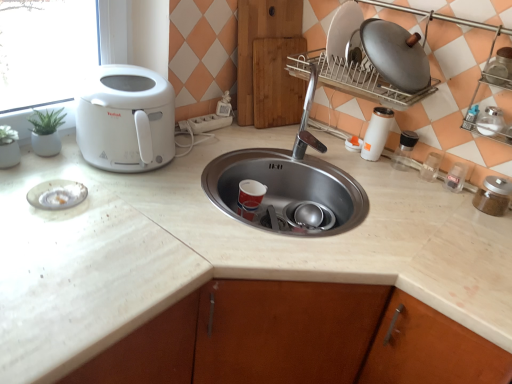
Question: Should I look upward or downward to see metallic silver pot at upper right, which is counted as the sixth appliance, starting from the left?

Choices:
 (A) down
 (B) up

Answer: (B)

Question: From a real-world perspective, is transparent plastic container at right, the fourth appliance in the left-to-right sequence, located beneath metallic silver pot at upper right, which is counted as the sixth appliance, starting from the left?

Choices:
 (A) yes
 (B) no

Answer: (A)

Question: Is transparent plastic container at right, the fourth appliance in the left-to-right sequence, taller than metallic silver pot at upper right, which is counted as the sixth appliance, starting from the left?

Choices:
 (A) yes
 (B) no

Answer: (B)

Question: Are transparent plastic container at right, which is counted as the 5th appliance, starting from the right, and metallic silver pot at upper right, which is counted as the sixth appliance, starting from the left, beside each other?

Choices:
 (A) no
 (B) yes

Answer: (A)

Question: Does transparent plastic container at right, the fourth appliance in the left-to-right sequence, appear on the left side of metallic silver pot at upper right, which appears as the 3th appliance when viewed from the right?

Choices:
 (A) no
 (B) yes

Answer: (B)

Question: Considering the relative sizes of transparent plastic container at right, which is counted as the 5th appliance, starting from the right, and metallic silver pot at upper right, which appears as the 3th appliance when viewed from the right, in the image provided, is transparent plastic container at right, which is counted as the 5th appliance, starting from the right, shorter than metallic silver pot at upper right, which appears as the 3th appliance when viewed from the right,?

Choices:
 (A) yes
 (B) no

Answer: (A)

Question: Does transparent plastic container at right, the fourth appliance in the left-to-right sequence, have a larger size compared to metallic silver pot at upper right, which is counted as the sixth appliance, starting from the left?

Choices:
 (A) yes
 (B) no

Answer: (B)

Question: From the image's perspective, is white marble countertop at center located above clear plastic container at right, which is the 4th appliance from right to left?

Choices:
 (A) yes
 (B) no

Answer: (B)

Question: Is white marble countertop at center thinner than clear plastic container at right, arranged as the fifth appliance when viewed from the left?

Choices:
 (A) yes
 (B) no

Answer: (B)

Question: Considering the relative positions of white marble countertop at center and clear plastic container at right, which is the 4th appliance from right to left, in the image provided, is white marble countertop at center to the right of clear plastic container at right, which is the 4th appliance from right to left, from the viewer's perspective?

Choices:
 (A) yes
 (B) no

Answer: (B)

Question: Is white marble countertop at center oriented towards clear plastic container at right, arranged as the fifth appliance when viewed from the left?

Choices:
 (A) yes
 (B) no

Answer: (B)

Question: Does white marble countertop at center come behind clear plastic container at right, which is the 4th appliance from right to left?

Choices:
 (A) yes
 (B) no

Answer: (B)

Question: From a real-world perspective, is white marble countertop at center beneath clear plastic container at right, which is the 4th appliance from right to left?

Choices:
 (A) no
 (B) yes

Answer: (B)

Question: Can you confirm if brown glass jar at right, the 8th appliance positioned from the left, is shorter than white plastic soap dispenser at upper right, the 8th appliance viewed from the right?

Choices:
 (A) yes
 (B) no

Answer: (B)